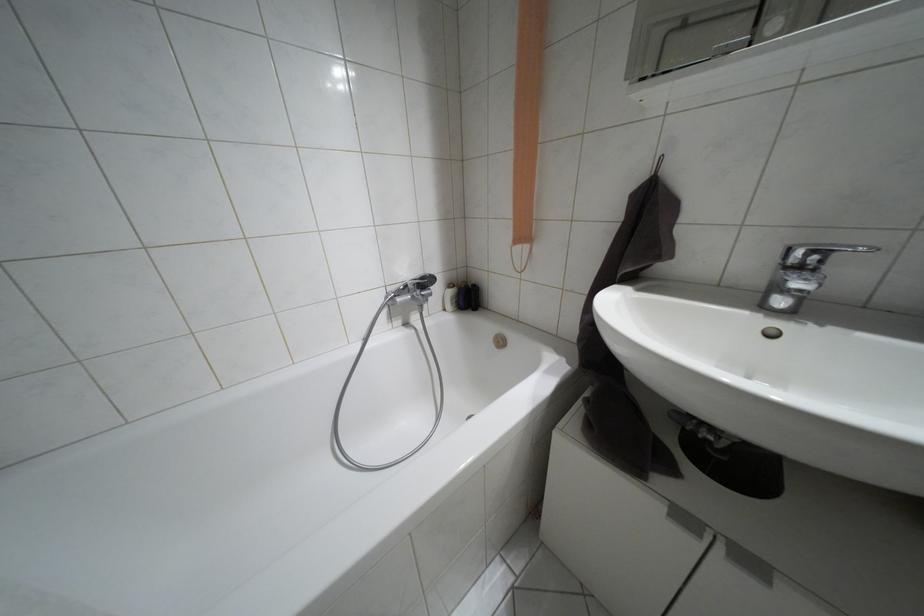
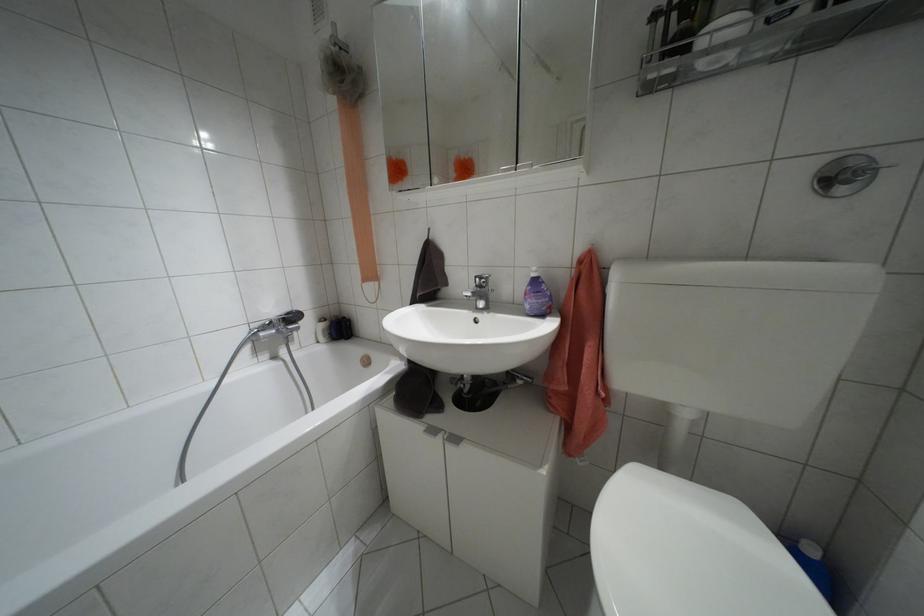
Where in the second image is the point corresponding to (x=684, y=517) from the first image?

(432, 430)